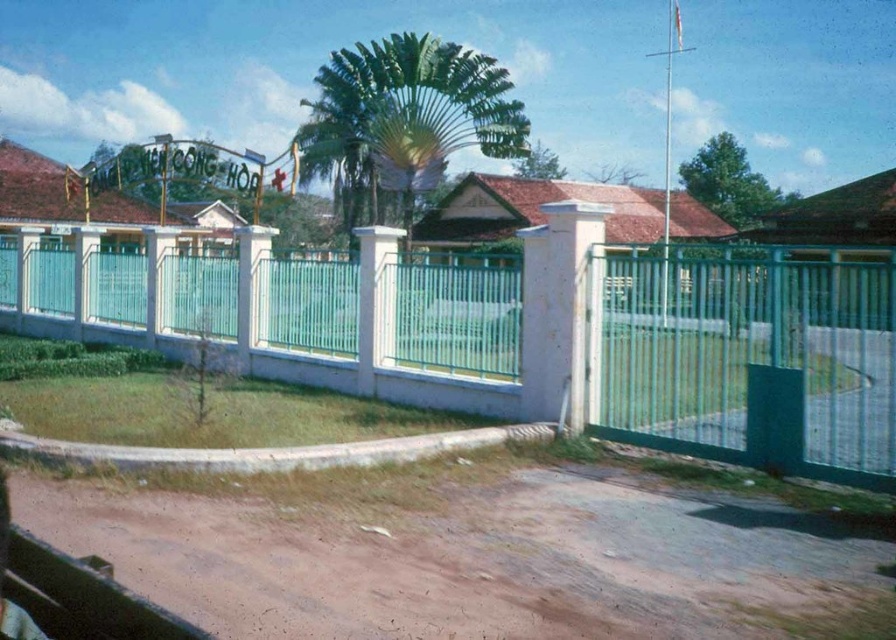
You are a delivery driver approaching the compound through the open gate. You see the brown dirt track at lower center and the green leafy palm tree at center. Which direction should you turn to follow the dirt track towards the palm tree?

To follow the brown dirt track at lower center towards the green leafy palm tree at center, you should turn to the left since the dirt track is to the right of the palm tree, meaning the palm tree is to the left of the track from your perspective.

You are a delivery driver approaching the open gate of the compound. You need to turn your truck onto the brown dirt track at lower center. Considering the width of the green leafy palm tree at center, will your truck fit through the track?

The brown dirt track at lower center has a lesser width compared to the green leafy palm tree at center, so the truck may not fit through the track if the palm tree is blocking the path.

You are a delivery driver arriving at the compound. Your vehicle is 2 meters wide. The teal metal fence at center and the brown dirt track at lower center are in your path. Can you safely pass through the gate without hitting the fence?

The teal metal fence at center might be wider than the brown dirt track at lower center. Since the vehicle is 2 meters wide, it depends on the actual width of the track. If the track is narrower than 2 meters, the vehicle cannot pass safely. However, without exact measurements, it is uncertain.